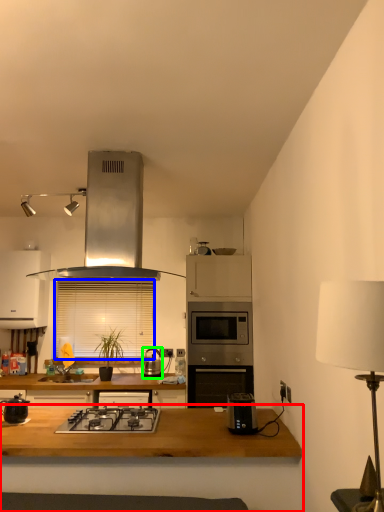
Question: Which object is positioned farthest from table (highlighted by a red box)? Select from window screen (highlighted by a blue box) and kitchen appliance (highlighted by a green box).

Choices:
 (A) window screen
 (B) kitchen appliance

Answer: (A)